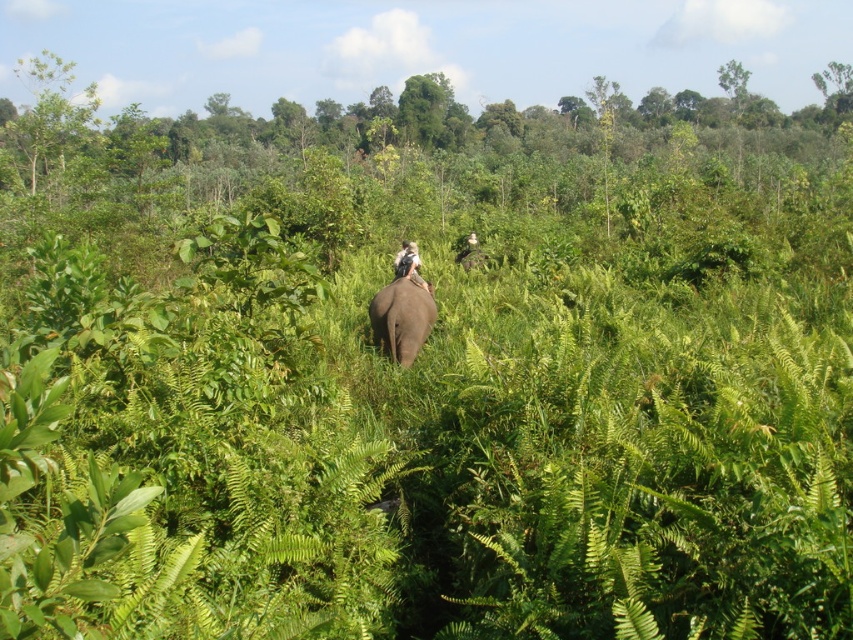
Question: Does green leafy tree at upper left appear on the left side of white cloth at center?

Choices:
 (A) yes
 (B) no

Answer: (A)

Question: Which point is farther from the camera taking this photo?

Choices:
 (A) (387, 308)
 (B) (26, 61)
 (C) (402, 259)

Answer: (B)

Question: Is gray matte elephant at center to the left of white fabric at center from the viewer's perspective?

Choices:
 (A) no
 (B) yes

Answer: (A)

Question: Among these objects, which one is nearest to the camera?

Choices:
 (A) white cloth at center
 (B) green leafy tree at upper left
 (C) white fabric at center
 (D) gray matte elephant at center

Answer: (D)

Question: Among these objects, which one is farthest from the camera?

Choices:
 (A) white fabric at center
 (B) gray matte elephant at center
 (C) green leafy tree at upper left
 (D) white cloth at center

Answer: (C)

Question: Can you confirm if white cloth at center is thinner than white fabric at center?

Choices:
 (A) yes
 (B) no

Answer: (B)